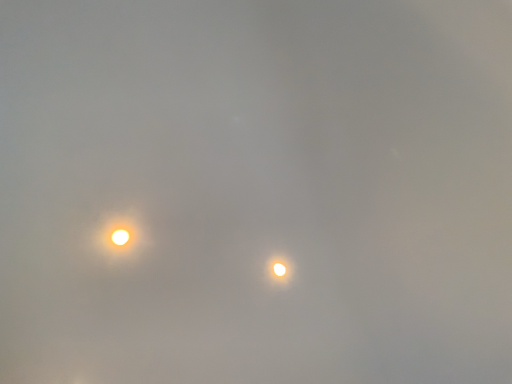
Question: Is bright yellow orb at upper left, which appears as the second moonlight when viewed from the right, completely or partially inside bright white sphere at center, the 2th moonlight from the left?

Choices:
 (A) yes
 (B) no

Answer: (B)

Question: Would you say bright white sphere at center, the 1th moonlight from the right, is a long distance from bright yellow orb at upper left, arranged as the 1th moonlight when viewed from the top?

Choices:
 (A) no
 (B) yes

Answer: (A)

Question: From a real-world perspective, is bright white sphere at center, which is counted as the first moonlight, starting from the back, positioned under bright yellow orb at upper left, the 1th moonlight from the left, based on gravity?

Choices:
 (A) no
 (B) yes

Answer: (A)

Question: Is bright white sphere at center, the 1th moonlight from the right, facing towards bright yellow orb at upper left, which ranks as the 1th moonlight in front-to-back order?

Choices:
 (A) yes
 (B) no

Answer: (B)

Question: Is bright white sphere at center, which is counted as the first moonlight, starting from the back, closer to the viewer compared to bright yellow orb at upper left, which is counted as the 2th moonlight, starting from the back?

Choices:
 (A) yes
 (B) no

Answer: (B)

Question: Does bright white sphere at center, the first moonlight ordered from the bottom, have a larger size compared to bright yellow orb at upper left, the 2th moonlight ordered from the bottom?

Choices:
 (A) no
 (B) yes

Answer: (A)

Question: From the image's perspective, is bright yellow orb at upper left, which is counted as the 2th moonlight, starting from the back, located beneath bright white sphere at center, the 1th moonlight from the right?

Choices:
 (A) no
 (B) yes

Answer: (A)

Question: Are bright yellow orb at upper left, which appears as the second moonlight when viewed from the right, and bright white sphere at center, which is counted as the first moonlight, starting from the back, beside each other?

Choices:
 (A) yes
 (B) no

Answer: (B)

Question: Is bright yellow orb at upper left, the 2th moonlight ordered from the bottom, outside bright white sphere at center, the 2th moonlight from the left?

Choices:
 (A) no
 (B) yes

Answer: (B)

Question: Can you confirm if bright yellow orb at upper left, which is counted as the 2th moonlight, starting from the back, is smaller than bright white sphere at center, arranged as the second moonlight when viewed from the front?

Choices:
 (A) yes
 (B) no

Answer: (B)

Question: Can you confirm if bright yellow orb at upper left, which appears as the second moonlight when viewed from the right, is positioned to the right of bright white sphere at center, arranged as the second moonlight when viewed from the front?

Choices:
 (A) yes
 (B) no

Answer: (B)

Question: Is bright yellow orb at upper left, the 1th moonlight from the left, closer to the viewer compared to bright white sphere at center, the 1th moonlight from the right?

Choices:
 (A) yes
 (B) no

Answer: (A)

Question: Based on their sizes in the image, would you say bright yellow orb at upper left, which appears as the second moonlight when viewed from the right, is bigger or smaller than bright white sphere at center, arranged as the second moonlight when viewed from the front?

Choices:
 (A) small
 (B) big

Answer: (B)